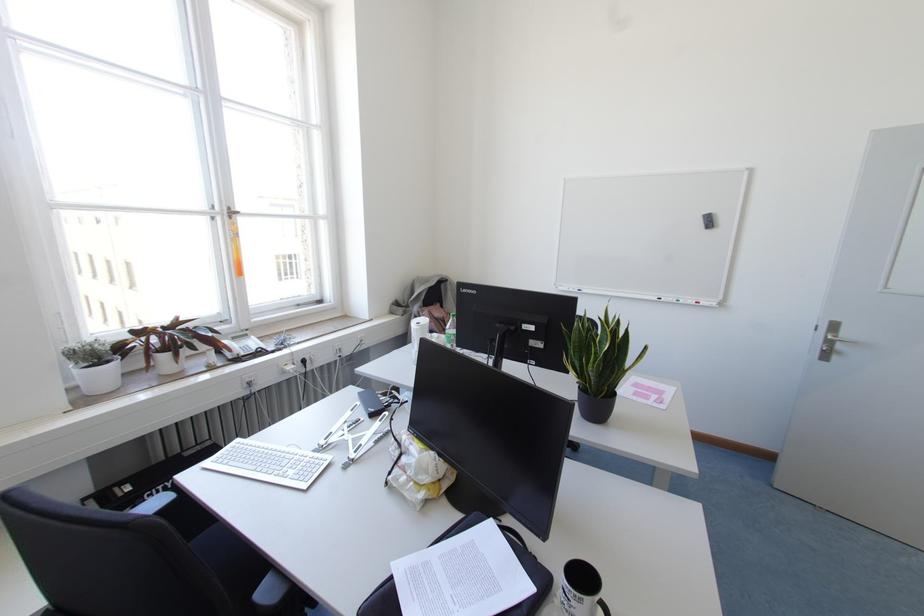
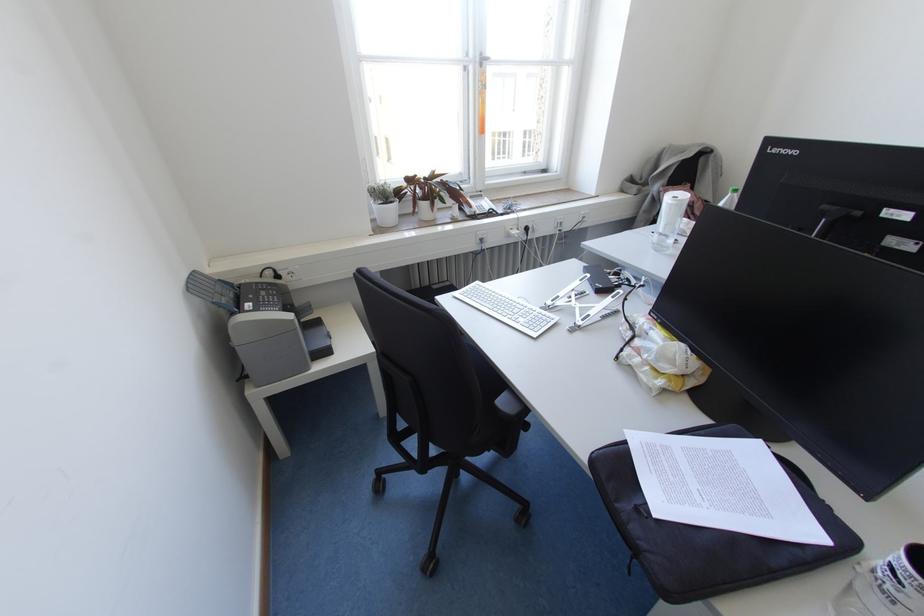
In the second image, find the point that corresponds to pixel 497 525 in the first image.

(762, 454)